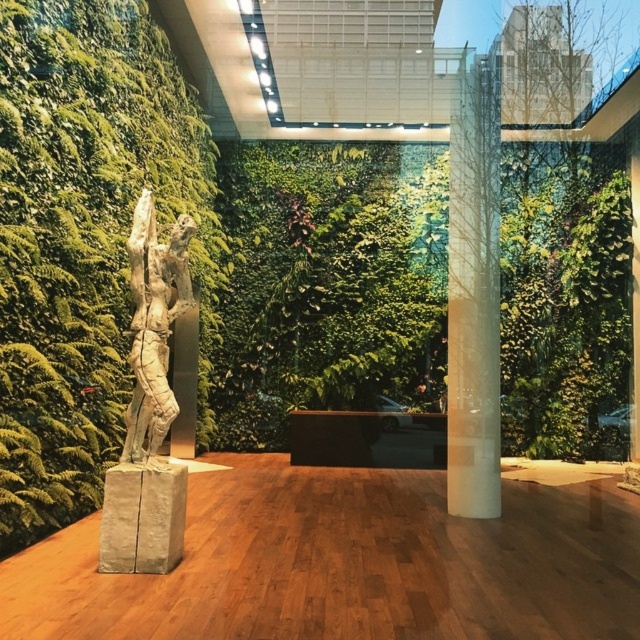
Is translucent glass column at center in front of bronze statue at center?

No, translucent glass column at center is further to the viewer.

Which of these two, translucent glass column at center or bronze statue at center, stands taller?

With more height is translucent glass column at center.

Is point (483, 100) positioned after point (136, 216)?

Yes, it is.

Locate an element on the screen. translucent glass column at center is located at coordinates (474, 294).

From the picture: Who is higher up, green leafy wall at left or bronze statue at center?

green leafy wall at left is higher up.

Is the position of green leafy wall at left more distant than that of bronze statue at center?

No, it is not.

Measure the distance between point (10, 525) and camera.

A distance of 11.19 feet exists between point (10, 525) and camera.

The height and width of the screenshot is (640, 640). Find the location of `green leafy wall at left`. green leafy wall at left is located at coordinates click(84, 240).

The width and height of the screenshot is (640, 640). I want to click on green leafy wall at left, so click(84, 240).

Can you confirm if green leafy wall at left is positioned to the left of translucent glass column at center?

Yes, green leafy wall at left is to the left of translucent glass column at center.

Between point (24, 131) and point (474, 413), which one is positioned in front?

Positioned in front is point (24, 131).

Where is `green leafy wall at left`? green leafy wall at left is located at coordinates (84, 240).